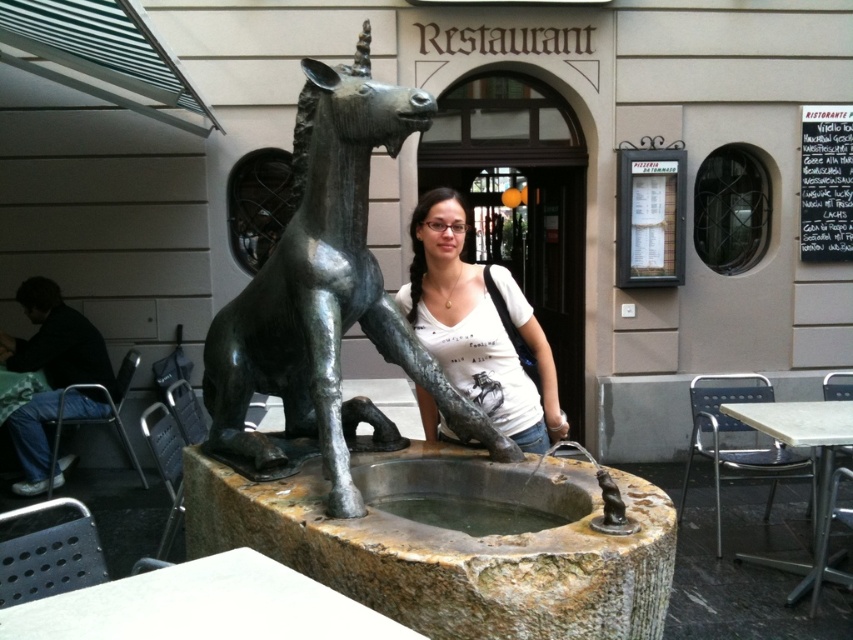
From the picture: You are standing in front of the bronze unicorn at center and want to take a photo with your camera. The camera requires a minimum distance of 2 meters to focus properly. Can you take a clear photo without moving closer or farther away?

The bronze unicorn at center and camera are 2.22 meters apart, which is more than the required 2 meters, so yes, you can take a clear photo without moving.

You are standing at the bronze statue of a unicorn and want to walk towards the entrance of the restaurant. There are two points marked on the path. Which point should you step on first, point (485, 324) or point (74, 337)?

You should step on point (485, 324) first because it is in front of point (74, 337) along the path towards the restaurant entrance.